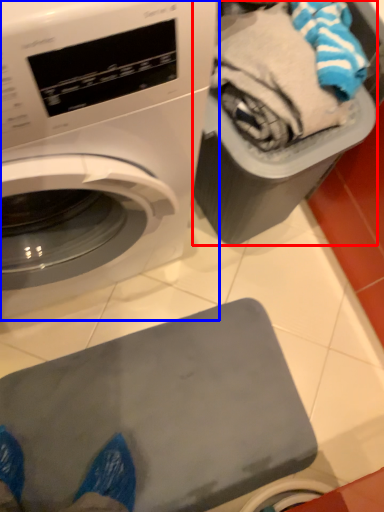
Question: Among these objects, which one is nearest to the camera, garbage (highlighted by a red box) or washing machine (highlighted by a blue box)?

Choices:
 (A) garbage
 (B) washing machine

Answer: (B)